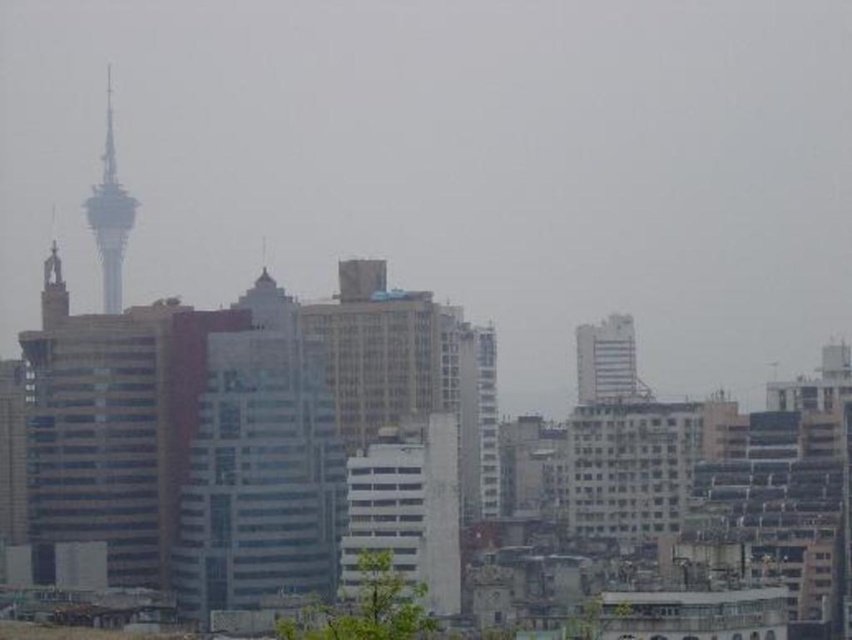
You are an architect analyzing the cityscape. You need to determine which structure is nearer to you when comparing the matte glass building at center and the metallic silver tower at left. Based on the scene, which one is closer?

The matte glass building at center is closer to the viewer than the metallic silver tower at left.

You are standing at the origin point in the cityscape image. You see two points marked as point 1 at coordinates point (x=113, y=192) and point 2 at coordinates point (x=593, y=340). Which point is closer to you?

Point (x=593, y=340) is closer to you because it is in front of point (x=113, y=192).

You are standing in the city and see both the metallic silver tower at left and the white glossy building at upper center. Which structure is closer to you?

The metallic silver tower at left is closer to you because it is positioned further to the viewer than the white glossy building at upper center.